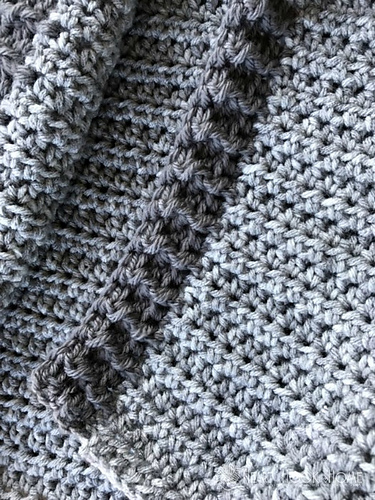
Identify the location of corner. The image size is (375, 500). (53, 376).